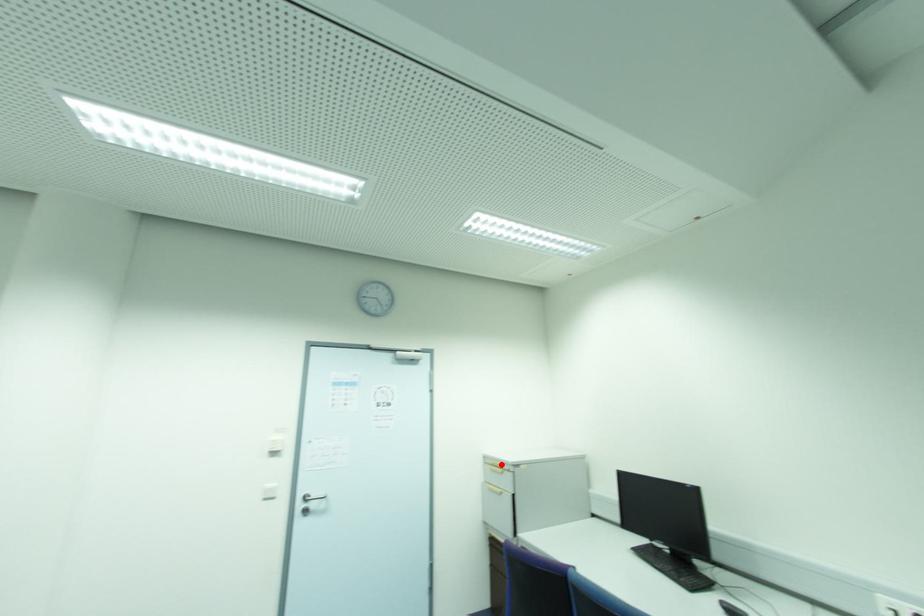
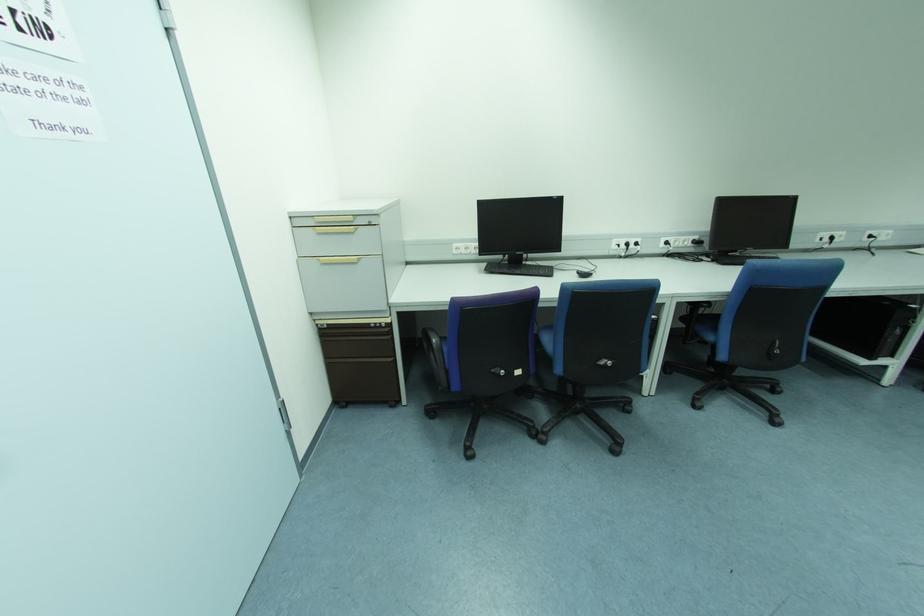
Locate, in the second image, the point that corresponds to the highlighted location in the first image.

(350, 219)